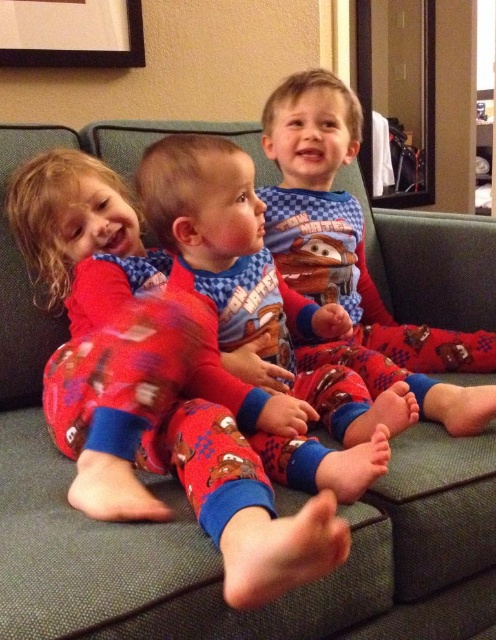
Question: Can you confirm if matte red pajamas at center is positioned below black matte picture frame at upper left?

Choices:
 (A) yes
 (B) no

Answer: (A)

Question: Estimate the real-world distances between objects in this image. Which object is closer to the matte red pajamas at center?

Choices:
 (A) matte blue pajamas at center
 (B) black matte picture frame at upper left

Answer: (A)

Question: Is matte blue pajamas at center behind black matte picture frame at upper left?

Choices:
 (A) no
 (B) yes

Answer: (A)

Question: Is matte blue pajamas at center further to the viewer compared to black matte picture frame at upper left?

Choices:
 (A) no
 (B) yes

Answer: (A)

Question: Which point is closer to the camera taking this photo?

Choices:
 (A) (346, 360)
 (B) (341, 499)
 (C) (55, 26)

Answer: (B)

Question: Which point is closer to the camera taking this photo?

Choices:
 (A) (317, 392)
 (B) (415, 381)
 (C) (85, 8)

Answer: (A)